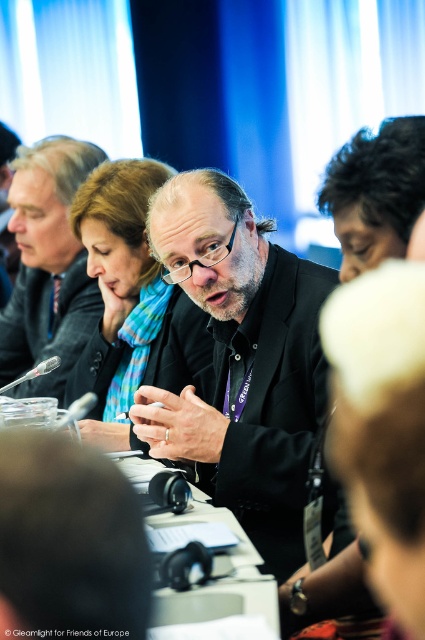
Which of these two, black matte jacket at center or matte black jacket at center, stands shorter?

With less height is black matte jacket at center.

The width and height of the screenshot is (425, 640). Identify the location of black matte jacket at center. (241, 360).

Consider the image. Between black matte jacket at center and white plastic table at center, which one has more height?

Standing taller between the two is black matte jacket at center.

Does black matte jacket at center have a lesser width compared to white plastic table at center?

No.

You are a GUI agent. You are given a task and a screenshot of the screen. Output one action in this format:
    pyautogui.click(x=<x>, y=<y>)
    Task: Click on the black matte jacket at center
    
    Given the screenshot: What is the action you would take?
    pyautogui.click(x=241, y=360)

Is point (71, 252) positioned in front of point (195, 605)?

No, (71, 252) is further to viewer.

Between matte black jacket at center and white plastic table at center, which one is positioned higher?

Positioned higher is matte black jacket at center.

Identify the location of matte black jacket at center. This screenshot has width=425, height=640. (48, 268).